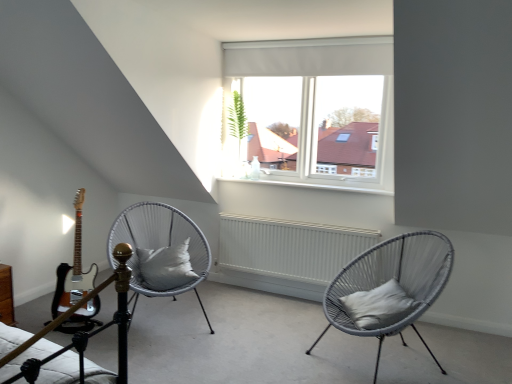
In order to click on free space that is to the left of woven grey chair at center, the second chair viewed from the left in this screenshot , I will do `click(274, 352)`.